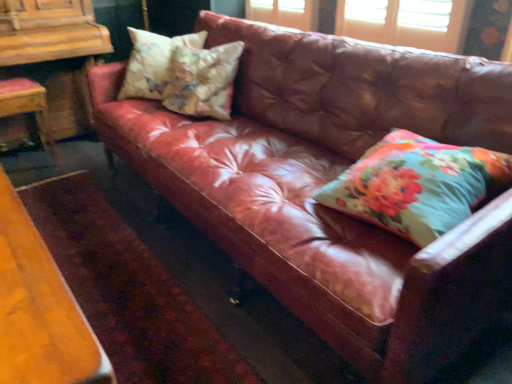
Question: Considering the positions of floral fabric pillow at upper left, acting as the first pillow starting from the left, and wooden chair at left in the image, is floral fabric pillow at upper left, acting as the first pillow starting from the left, taller or shorter than wooden chair at left?

Choices:
 (A) short
 (B) tall

Answer: (A)

Question: In the image, is floral fabric pillow at upper left, the first pillow when ordered from back to front, positioned in front of or behind wooden chair at left?

Choices:
 (A) front
 (B) behind

Answer: (A)

Question: Which object is the farthest from the wooden chair at left?

Choices:
 (A) floral fabric cushion at upper left, the 2th pillow positioned from the right
 (B) wooden dresser at left
 (C) floral fabric pillow at right, placed as the 3th pillow when sorted from left to right
 (D) floral fabric pillow at upper left, acting as the first pillow starting from the left

Answer: (C)

Question: Estimate the real-world distances between objects in this image. Which object is closer to the wooden chair at left?

Choices:
 (A) floral fabric cushion at upper left, which is the second pillow from front to back
 (B) wooden dresser at left
 (C) floral fabric pillow at upper left, positioned as the third pillow in front-to-back order
 (D) floral fabric pillow at right, placed as the third pillow when sorted from back to front

Answer: (B)